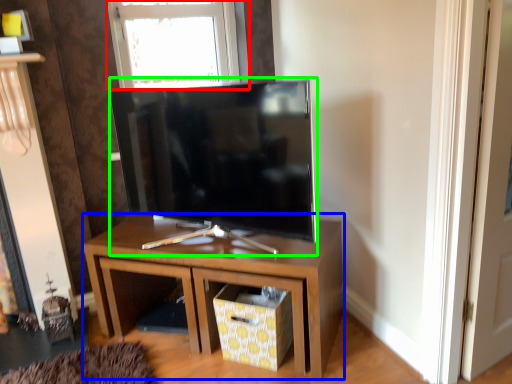
Question: Which object is positioned farthest from window (highlighted by a red box)? Select from nightstand (highlighted by a blue box) and television (highlighted by a green box).

Choices:
 (A) nightstand
 (B) television

Answer: (A)